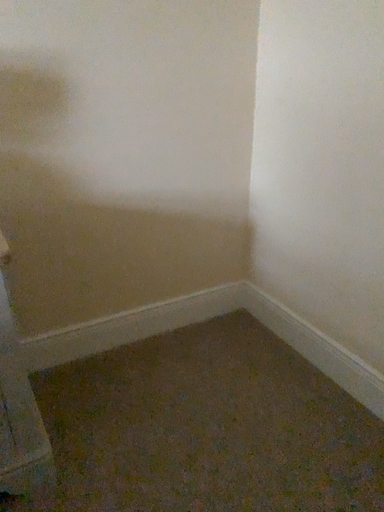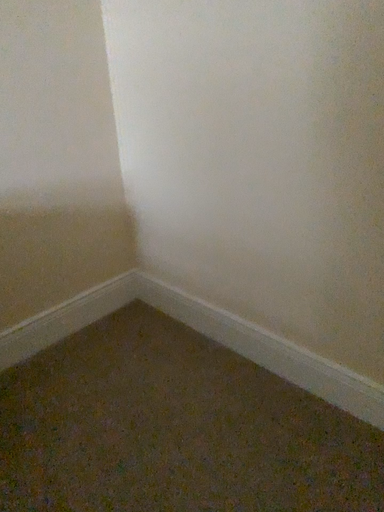
Question: How did the camera likely rotate when shooting the video?

Choices:
 (A) rotated left
 (B) rotated right

Answer: (B)